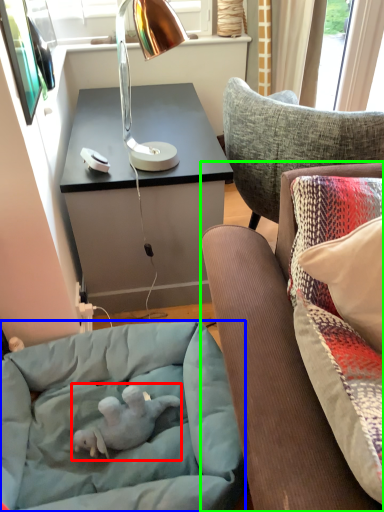
Question: Which object is positioned closest to baby elephant (highlighted by a red box)? Select from dog bed (highlighted by a blue box) and studio couch (highlighted by a green box).

Choices:
 (A) dog bed
 (B) studio couch

Answer: (A)